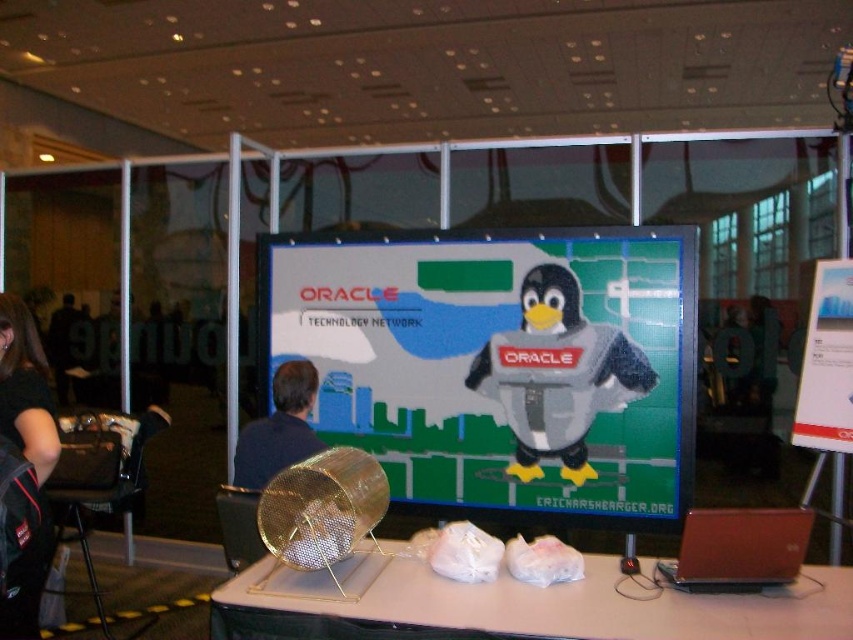
Is point (526, 403) positioned after point (16, 385)?

Yes, it is behind point (16, 385).

How much distance is there between matte plastic screen at center and black fabric backpack at lower left?

matte plastic screen at center and black fabric backpack at lower left are 6.38 feet apart from each other.

Between point (560, 428) and point (35, 609), which one is positioned in front?

Point (35, 609) is in front.

Find the location of `matte plastic screen at center`. matte plastic screen at center is located at coordinates (498, 364).

Between fuzzy fabric penguin at center and black fabric backpack at lower left, which one appears on the right side from the viewer's perspective?

fuzzy fabric penguin at center

Based on the photo, can you confirm if fuzzy fabric penguin at center is bigger than black fabric backpack at lower left?

No, fuzzy fabric penguin at center is not bigger than black fabric backpack at lower left.

Who is more distant from viewer, [561,368] or [30,428]?

The point [561,368] is behind.

Find the location of a particular element. The height and width of the screenshot is (640, 853). fuzzy fabric penguin at center is located at coordinates (556, 374).

Which is more to the left, white plastic table at center or dark blue shirt at center?

From the viewer's perspective, dark blue shirt at center appears more on the left side.

What do you see at coordinates (527, 604) in the screenshot? This screenshot has height=640, width=853. I see `white plastic table at center` at bounding box center [527, 604].

Find the location of a particular element. This screenshot has width=853, height=640. white plastic table at center is located at coordinates (527, 604).